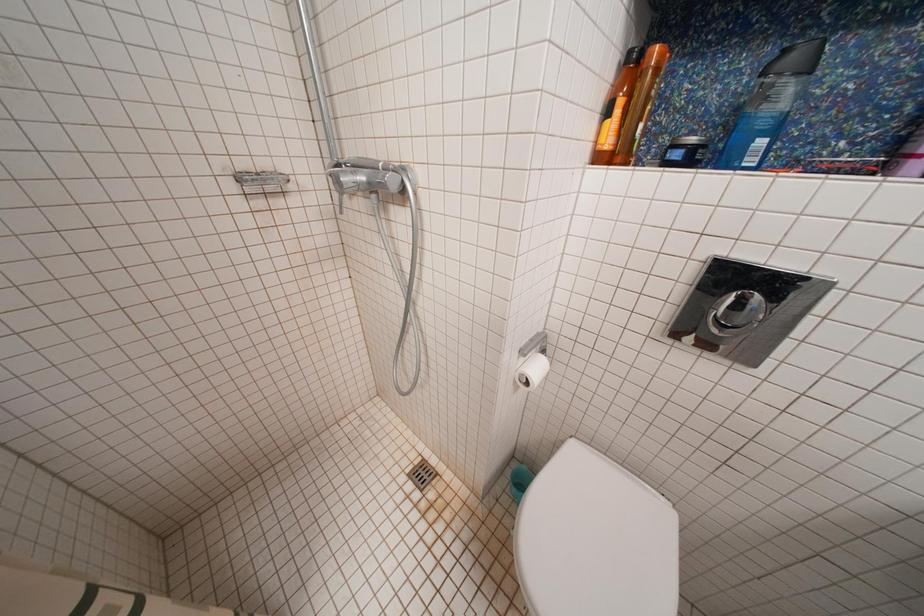
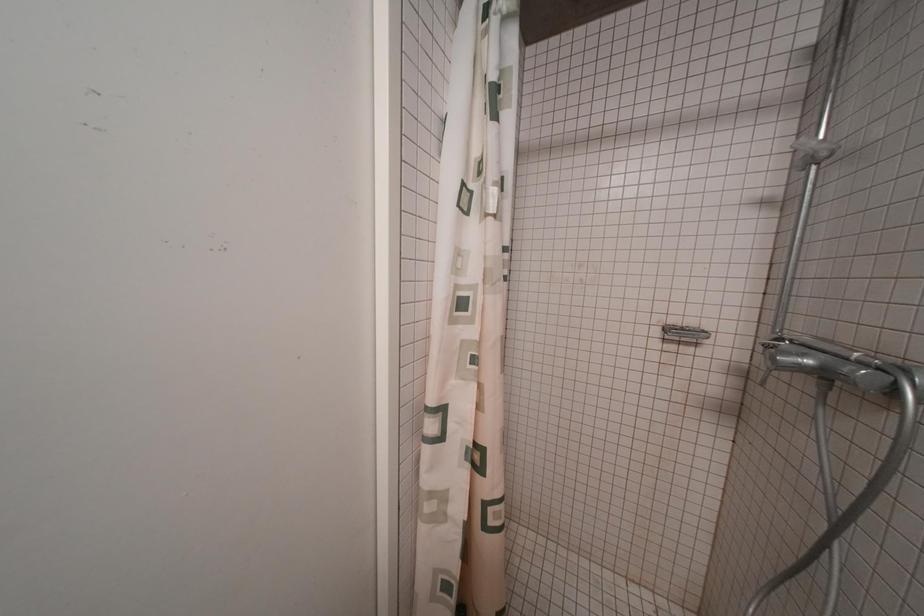
Question: The camera is either moving clockwise (left) or counter-clockwise (right) around the object. The first image is from the beginning of the video and the second image is from the end. Is the camera moving left or right when shooting the video?

Choices:
 (A) Left
 (B) Right

Answer: (B)